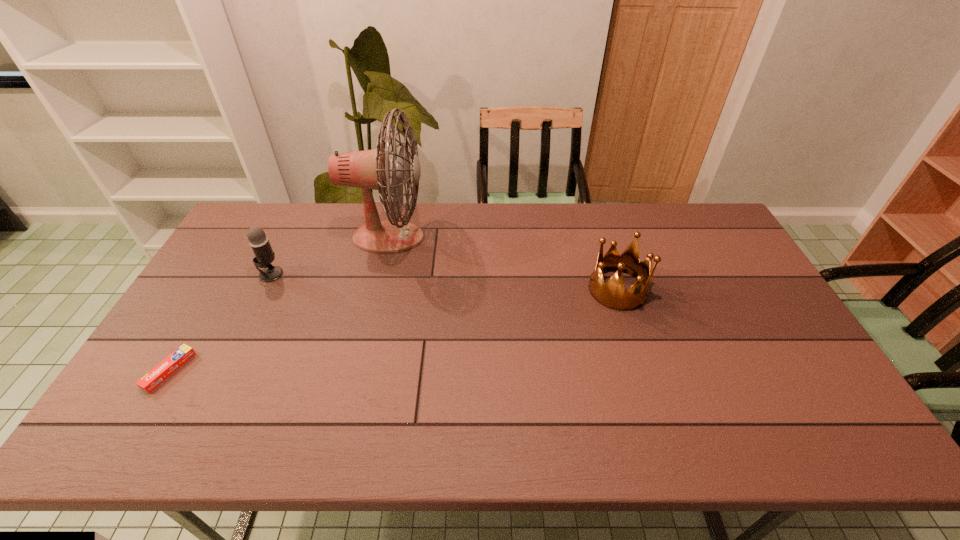
This screenshot has height=540, width=960. What are the coordinates of `object that can be found as the closest to the microphone` in the screenshot? It's located at (370, 169).

Where is `vacant space that satisfies the following two spatial constraints: 1. in front of the rightmost object to direct airflow; 2. on the left side of the third object from left to right`? This screenshot has width=960, height=540. vacant space that satisfies the following two spatial constraints: 1. in front of the rightmost object to direct airflow; 2. on the left side of the third object from left to right is located at coordinates (376, 289).

In order to click on free space that satisfies the following two spatial constraints: 1. in front of the tallest object to direct airflow; 2. on the right side of the rightmost object in this screenshot , I will do `click(376, 289)`.

Identify the location of vacant space that satisfies the following two spatial constraints: 1. in front of the rightmost object to direct airflow; 2. on the left side of the tallest object. This screenshot has width=960, height=540. (376, 289).

At what (x,y) coordinates should I click in order to perform the action: click on vacant space that satisfies the following two spatial constraints: 1. on the back side of the rightmost object; 2. on the left side of the leftmost object. Please return your answer as a coordinate pair (x, y). The width and height of the screenshot is (960, 540). Looking at the image, I should click on (218, 289).